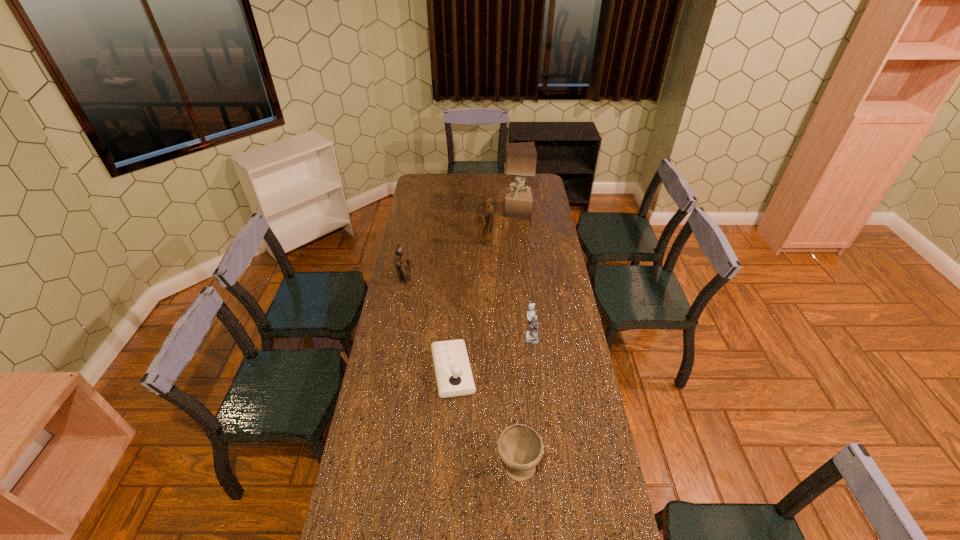
Find the location of a particular element. vacant space situated 0.340m on the left of the second shortest object is located at coordinates (394, 468).

Image resolution: width=960 pixels, height=540 pixels. What are the coordinates of `vacant space situated 0.130m on the back of the second object from left to right` in the screenshot? It's located at (455, 323).

Identify the location of object present at the left edge. This screenshot has width=960, height=540. (401, 260).

Locate an element on the screen. The height and width of the screenshot is (540, 960). object located in the right edge section of the desktop is located at coordinates coord(520,158).

Locate an element on the screen. This screenshot has height=540, width=960. vacant area at the left edge of the desktop is located at coordinates (401, 240).

In the image, there is a desktop. In order to click on vacant space at the right edge in this screenshot , I will do `click(528, 222)`.

Locate an element on the screen. Image resolution: width=960 pixels, height=540 pixels. vacant area that lies between the tallest figurine and the sculpture is located at coordinates (501, 228).

Find the location of a particular element. Image resolution: width=960 pixels, height=540 pixels. vacant space that is in between the shortest object and the tallest object is located at coordinates (485, 292).

You are a GUI agent. You are given a task and a screenshot of the screen. Output one action in this format:
    pyautogui.click(x=<x>, y=<y>)
    Task: Click on the vacant area that lies between the tallest object and the leftmost figurine
    
    Given the screenshot: What is the action you would take?
    pyautogui.click(x=462, y=246)

This screenshot has height=540, width=960. In order to click on free space between the leftmost object and the third nearest object in this screenshot , I will do `click(468, 309)`.